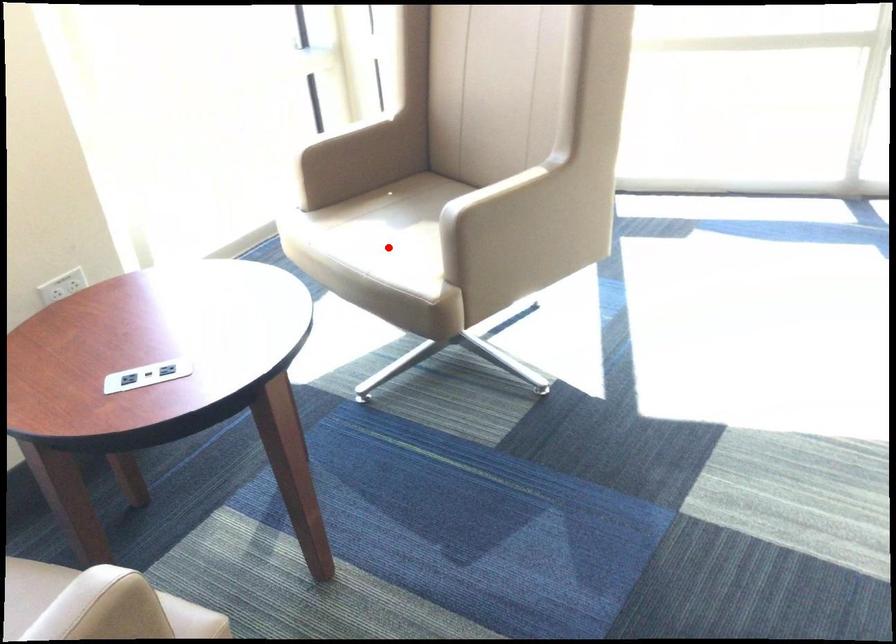
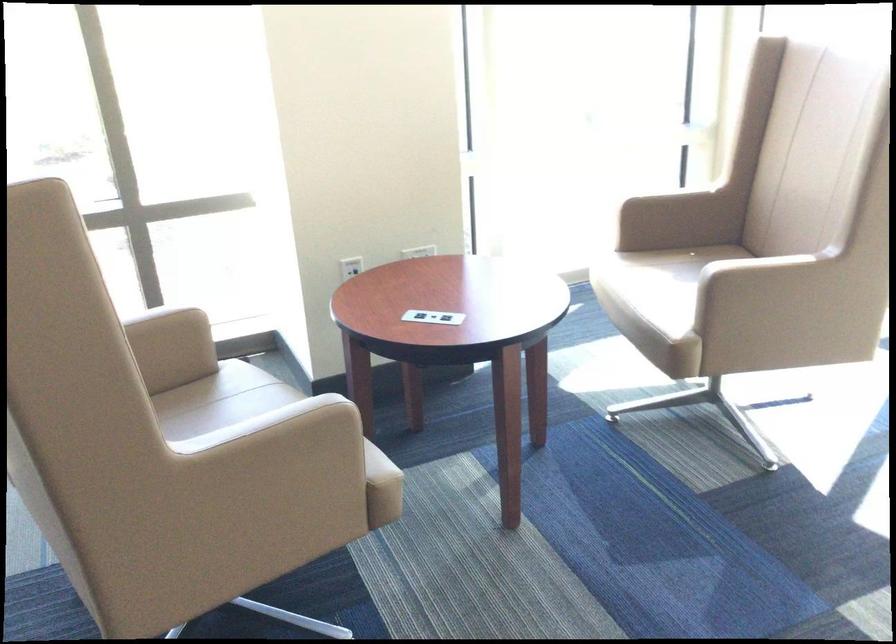
Question: I am providing you with two images of the same scene from different viewpoints. In image1, a red point is highlighted. Considering the same 3D point in image2, which of the following is correct?

Choices:
 (A) It is closer
 (B) It is farther

Answer: (B)